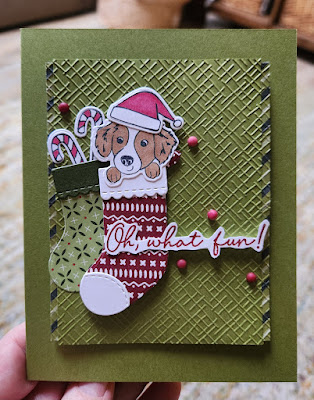
The width and height of the screenshot is (314, 400). What are the coordinates of `christmas stockings` in the screenshot? It's located at pyautogui.click(x=131, y=202), pyautogui.click(x=86, y=250).